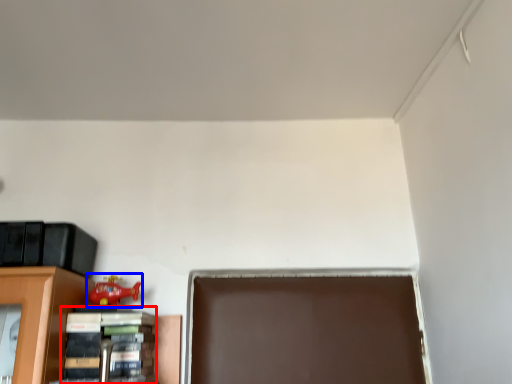
Question: Among these objects, which one is nearest to the camera, book (highlighted by a red box) or toy (highlighted by a blue box)?

Choices:
 (A) book
 (B) toy

Answer: (A)